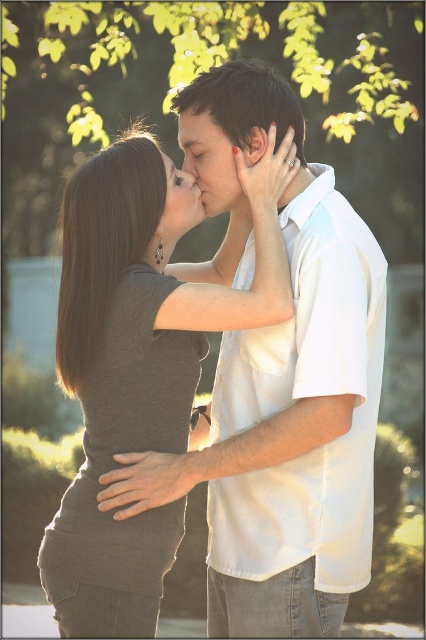
Question: Is white cotton shirt at center below smooth skin face at center?

Choices:
 (A) yes
 (B) no

Answer: (A)

Question: Which of the following is the closest to the observer?

Choices:
 (A) white cotton shirt at center
 (B) matte gray shirt at center
 (C) matte white face at center

Answer: (A)

Question: Which object appears closest to the camera in this image?

Choices:
 (A) matte gray shirt at center
 (B) matte white face at center
 (C) smooth skin face at center

Answer: (A)

Question: Estimate the real-world distances between objects in this image. Which object is farther from the smooth skin face at center?

Choices:
 (A) white cotton shirt at center
 (B) matte white face at center
 (C) matte gray shirt at center

Answer: (A)

Question: Does smooth skin face at center appear under matte white face at center?

Choices:
 (A) no
 (B) yes

Answer: (A)

Question: Is white cotton shirt at center positioned behind matte white face at center?

Choices:
 (A) no
 (B) yes

Answer: (A)